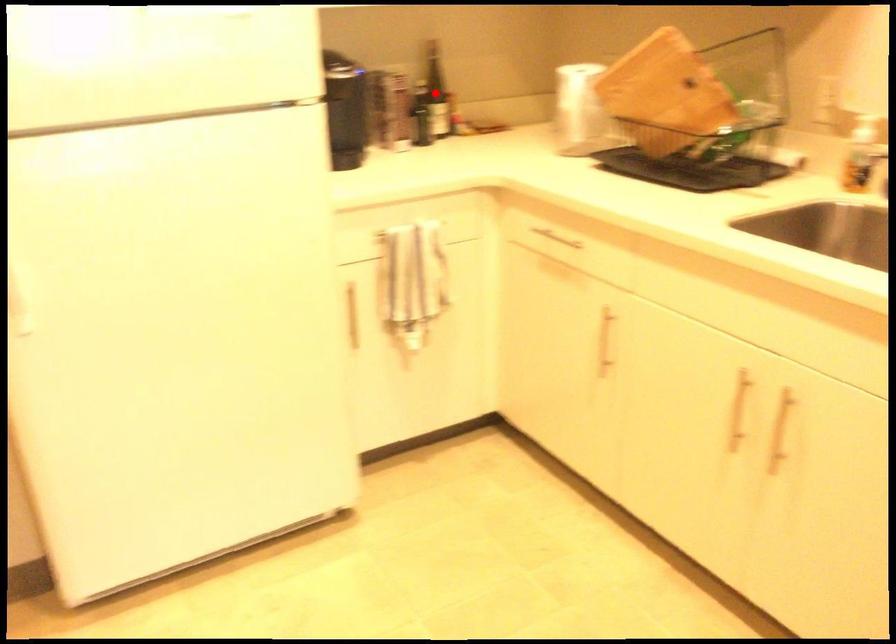
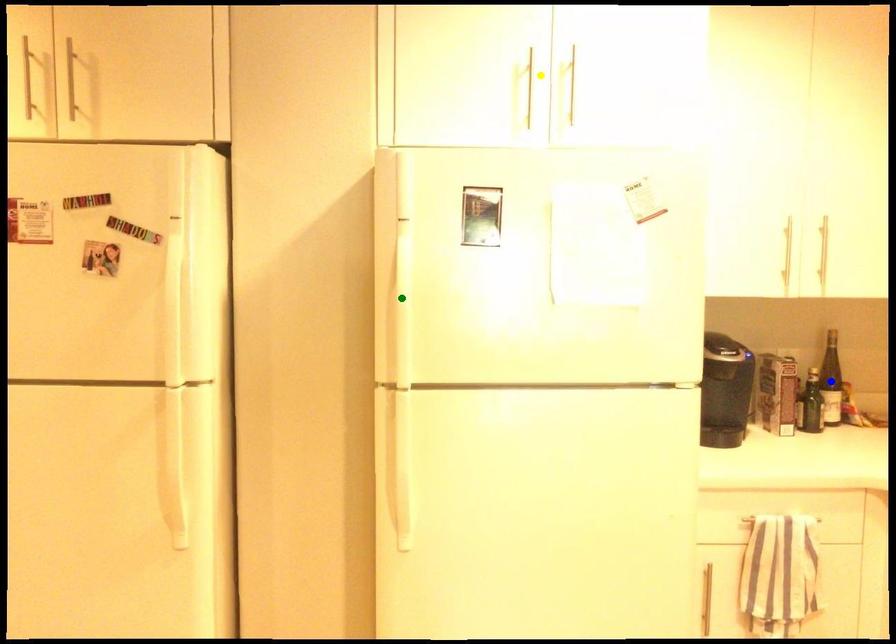
Question: I am providing you with two images of the same scene from different viewpoints. A red point is marked on the first image. You are given multiple points on the second image. Which point in image 2 is actually the same real-world point as the red point in image 1?

Choices:
 (A) yellow point
 (B) green point
 (C) blue point

Answer: (C)